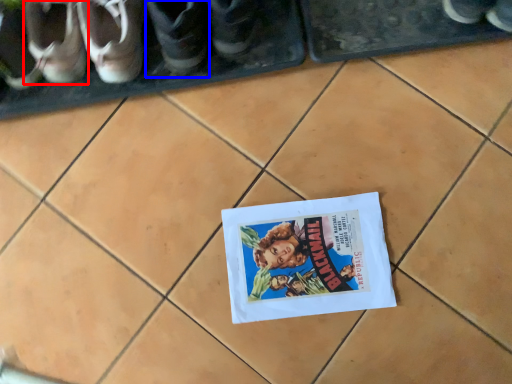
Question: Among these objects, which one is farthest to the camera, footwear (highlighted by a red box) or footwear (highlighted by a blue box)?

Choices:
 (A) footwear
 (B) footwear

Answer: (A)